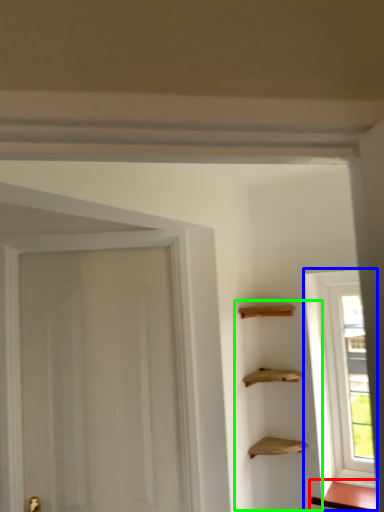
Question: Which object is the farthest from cabinetry (highlighted by a red box)? Choose among these: window (highlighted by a blue box) or cabinetry (highlighted by a green box).

Choices:
 (A) window
 (B) cabinetry

Answer: (B)